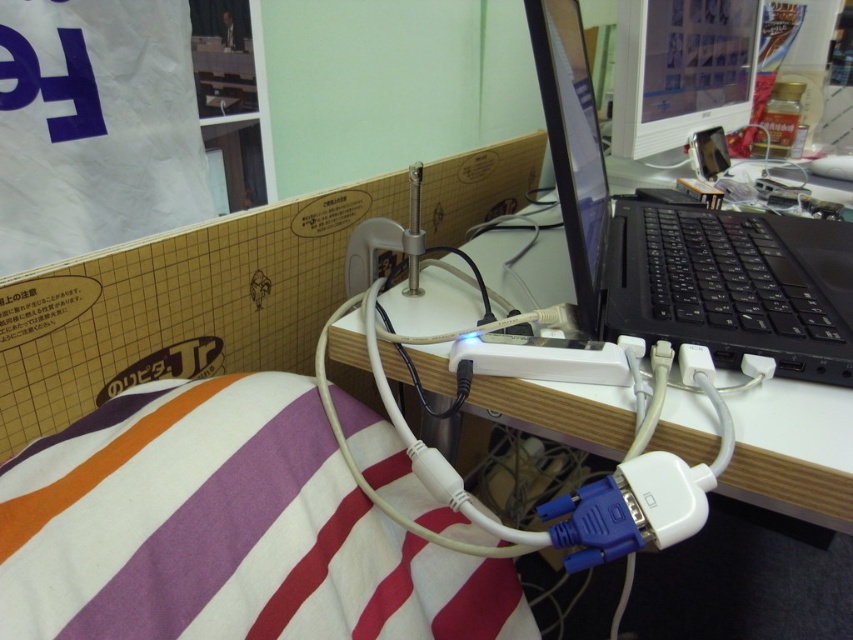
From the picture: You are organizing the cables on your desk and need to place a new cable organizer. The black plastic laptop at center is currently at position coordinates. Where should you place the cable organizer relative to the laptop?

The black plastic laptop at center is located at point coordinates, so the cable organizer should be placed near the laptop to manage the cables effectively.

You are organizing the desk and want to place a new item between the white striped blanket at lower left and the black plastic laptop at center. Considering their heights, which object should you place the new item closer to?

You should place the new item closer to the white striped blanket at lower left because it has a lesser height compared to the black plastic laptop at center, allowing more space for the new item.

You are organizing your workspace and need to know if the black plastic laptop at center can fit under the white plastic computer desk at center. Based on their heights, can it be placed underneath?

The black plastic laptop at center is not as tall as the white plastic computer desk at center, so it can fit underneath since it is shorter in height.